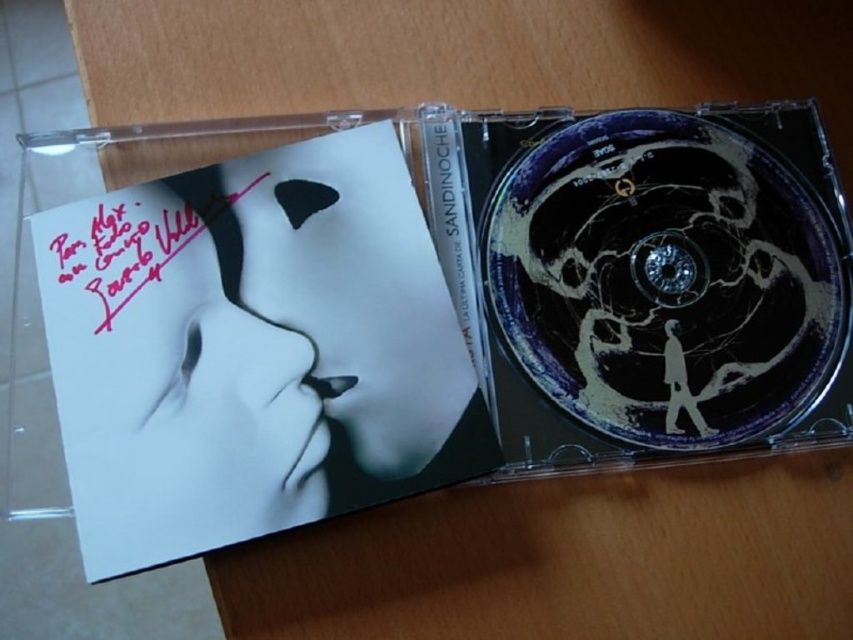
You are an art curator examining the CD case. You notice a point at coordinates (231, 346) on the CD case. What object is located at this point?

The white matte mask at upper left is located at point (231, 346).

You are examining the CD case and notice two points on its surface. The first point is at coordinates point (165,237), and the second is at point (450,220). Which point is nearer to your eyes when you look at the CD case?

Point (165,237) is closer to the viewer than point (450,220).

From the picture: You are an art curator arranging an exhibition. You need to place a label next to the white matte mask at upper left and the satin black text at center so that visitors can easily read both. Based on their positions, where should you place the label relative to the CD case?

The white matte mask at upper left is located below the satin black text at center, so the label should be placed above the satin black text at center to ensure both elements are visible and accessible to visitors.